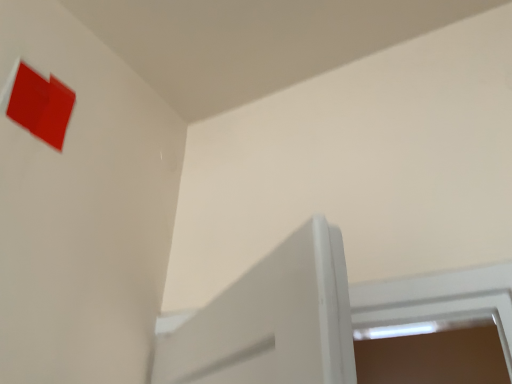
Question: Should I look upward or downward to see matte red paper at upper left?

Choices:
 (A) down
 (B) up

Answer: (B)